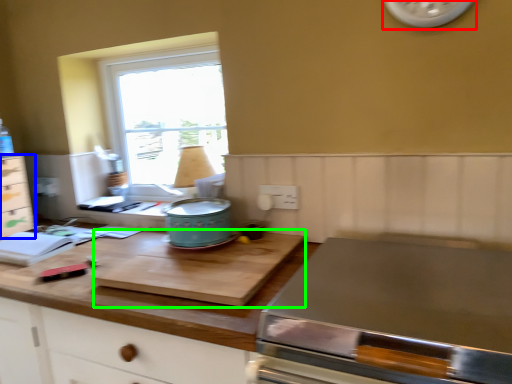
Question: Estimate the real-world distances between objects in this image. Which object is closer to clock (highlighted by a red box), cabinetry (highlighted by a blue box) or cutting board (highlighted by a green box)?

Choices:
 (A) cabinetry
 (B) cutting board

Answer: (B)